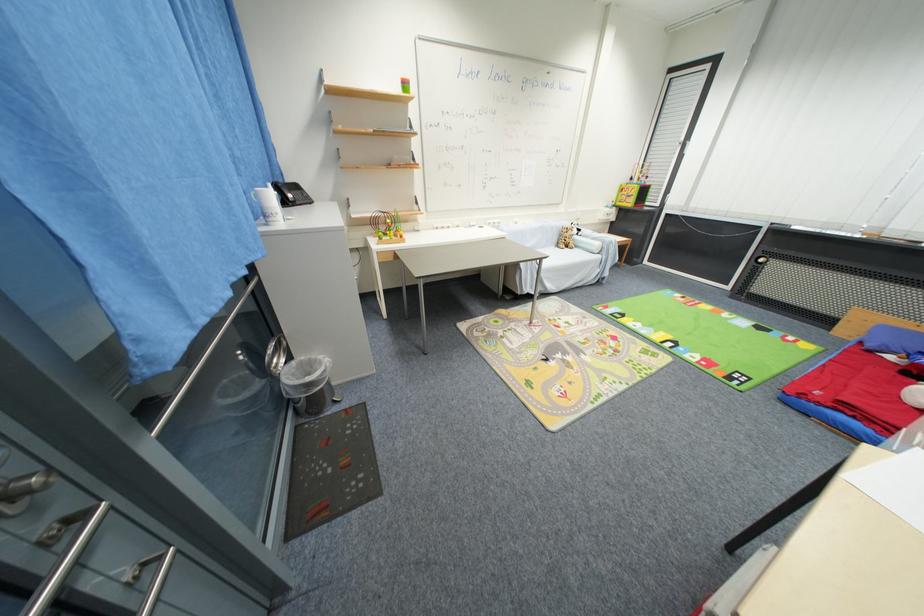
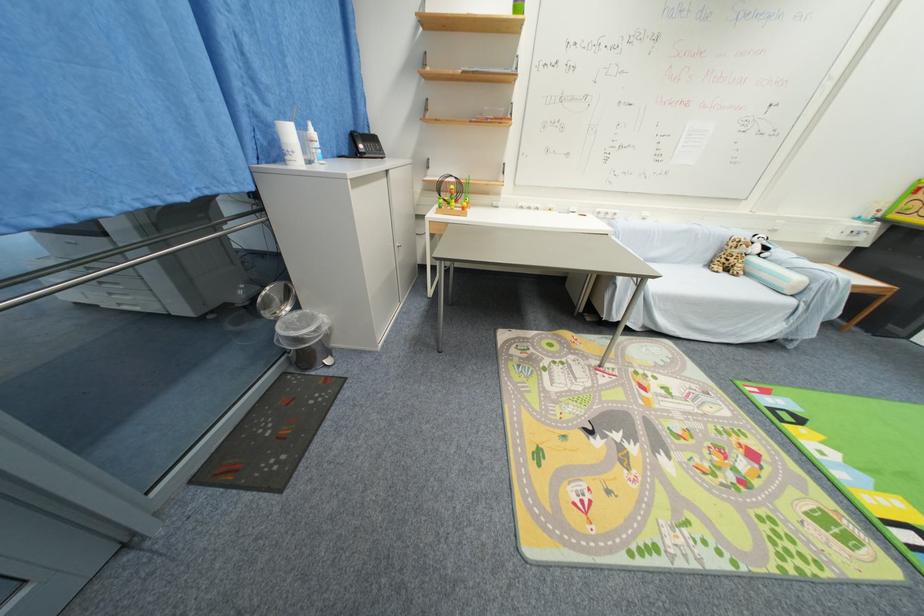
Find the pixel in the second image that matches (x=580, y=233) in the first image.

(761, 251)